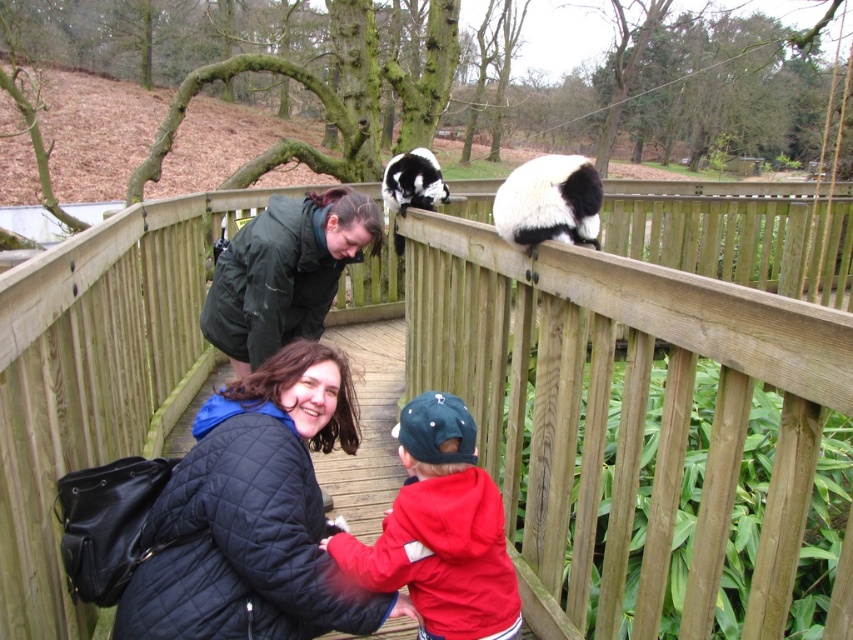
Can you confirm if quilted black jacket at center is positioned above black and white fur at upper right?

Actually, quilted black jacket at center is below black and white fur at upper right.

Who is positioned more to the right, quilted black jacket at center or black and white fur at upper right?

black and white fur at upper right is more to the right.

This screenshot has height=640, width=853. Find the location of `quilted black jacket at center`. quilted black jacket at center is located at coordinates (254, 515).

Measure the distance from quilted black jacket at center to black and white fur panda at upper center.

The distance of quilted black jacket at center from black and white fur panda at upper center is 2.23 meters.

Is the position of quilted black jacket at center more distant than that of black and white fur panda at upper center?

No.

The image size is (853, 640). What are the coordinates of `quilted black jacket at center` in the screenshot? It's located at (254, 515).

From the picture: Is dark green jacket at upper center taller than black and white fur at upper right?

In fact, dark green jacket at upper center may be shorter than black and white fur at upper right.

Is dark green jacket at upper center thinner than black and white fur at upper right?

No.

This screenshot has width=853, height=640. Identify the location of dark green jacket at upper center. (285, 273).

Locate an element on the screen. The width and height of the screenshot is (853, 640). dark green jacket at upper center is located at coordinates (285, 273).